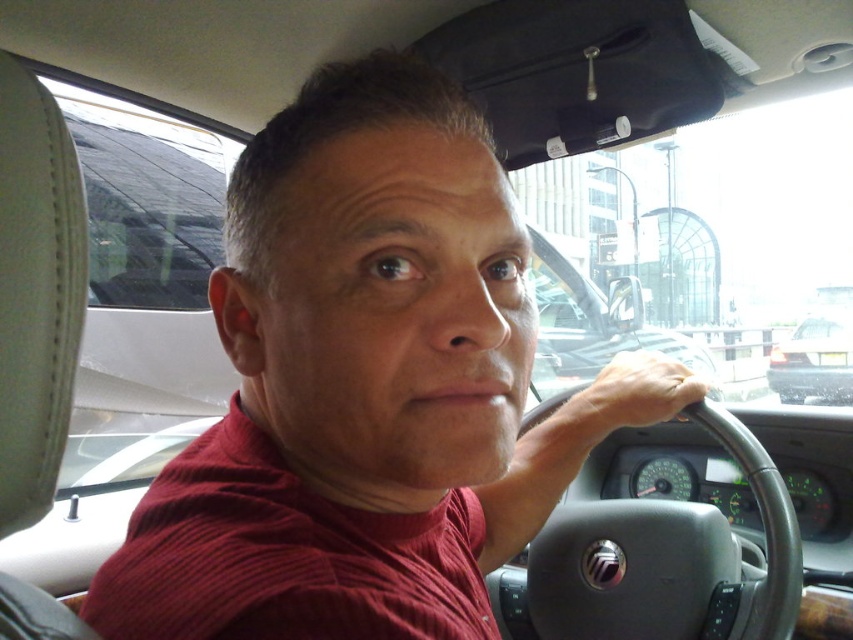
You are a passenger in the car and want to reach the black leather steering wheel at center to adjust the radio. Considering your arm length is 28 inches, can you comfortably reach it from your seat?

The black leather steering wheel at center is 37.06 inches away from viewer. Since your arm length is 28 inches, you cannot comfortably reach it from your seat.

You are a passenger in the car and want to know if you can easily reach the radio controls on the dashboard without stretching too much. Considering the height of the black leather steering wheel at center and the smooth skin hand at steering wheel, can you estimate if the radio controls are within comfortable reach?

The black leather steering wheel at center is taller than the smooth skin hand at steering wheel, which suggests that the steering wheel is positioned higher than the hand. This might mean the radio controls on the dashboard are within comfortable reach as the hand can easily move downward from the steering wheel to the controls.

You are a driver who needs to adjust the distance between your hand and the steering wheel for better control. Given that the black leather steering wheel at center is 28.10 centimeters away from the smooth skin hand at steering wheel, is the current distance sufficient for safe driving according to standard recommendations?

The standard recommendation for hand distance from the steering wheel is at least 25 centimeters to ensure safety and proper control. Since the black leather steering wheel at center is 28.10 centimeters away from the smooth skin hand at steering wheel, the current distance meets the safety requirement.